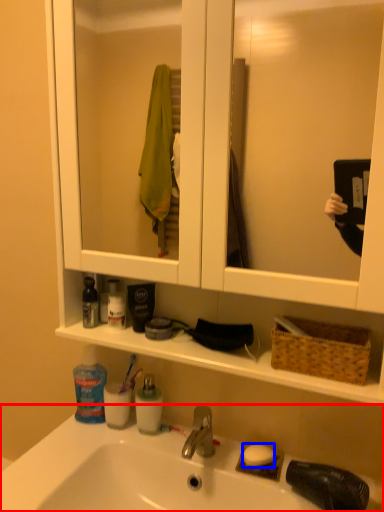
Question: Among these objects, which one is farthest to the camera, sink (highlighted by a red box) or soap (highlighted by a blue box)?

Choices:
 (A) sink
 (B) soap

Answer: (B)